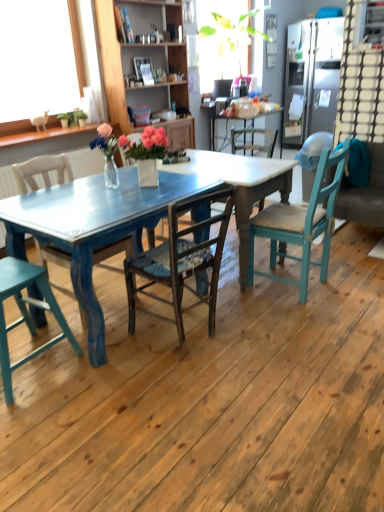
What is the approximate width of satin silver refrigerator at upper right?

It is 32.47 inches.

Looking at this image, what is the approximate width of teal fabric couch at right?

It is 30.17 inches.

Identify the location of wooden chair at center, acting as the 3th chair starting from the right. (42, 170).

Identify the location of satin silver refrigerator at upper right. (311, 77).

Does teal fabric couch at right turn towards wooden cabinet at upper center?

No, teal fabric couch at right is not aimed at wooden cabinet at upper center.

Is teal fabric couch at right inside the boundaries of wooden cabinet at upper center, or outside?

teal fabric couch at right exists outside the volume of wooden cabinet at upper center.

From the picture: From a real-world perspective, is teal fabric couch at right on wooden cabinet at upper center?

Actually, teal fabric couch at right is physically below wooden cabinet at upper center in the real world.

Can you tell me how much teal fabric couch at right and teal painted wood chair at lower left, placed as the 1th chair when sorted from left to right, differ in facing direction?

There is a 177-degree angle between the facing directions of teal fabric couch at right and teal painted wood chair at lower left, placed as the 1th chair when sorted from left to right.

Where is `couch above the teal painted wood chair at lower left, placed as the 1th chair when sorted from left to right (from the image's perspective)`? This screenshot has height=512, width=384. couch above the teal painted wood chair at lower left, placed as the 1th chair when sorted from left to right (from the image's perspective) is located at coordinates (364, 193).

Is teal fabric couch at right placed right next to teal painted wood chair at lower left, placed as the 1th chair when sorted from left to right?

teal fabric couch at right and teal painted wood chair at lower left, placed as the 1th chair when sorted from left to right, are clearly separated.

Which is less distant, (354, 194) or (9, 402)?

Point (354, 194) is farther from the camera than point (9, 402).

Considering the sizes of objects satin silver refrigerator at upper right and teal fabric couch at right in the image provided, who is shorter, satin silver refrigerator at upper right or teal fabric couch at right?

With less height is teal fabric couch at right.

Where is `couch beneath the satin silver refrigerator at upper right (from a real-world perspective)`? The height and width of the screenshot is (512, 384). couch beneath the satin silver refrigerator at upper right (from a real-world perspective) is located at coordinates (364, 193).

Which object is thinner, satin silver refrigerator at upper right or teal fabric couch at right?

teal fabric couch at right is thinner.

Does wooden chair at center, positioned as the second chair in left-to-right order, appear on the right side of teal painted wood chair at lower left, arranged as the 4th chair when viewed from the right?

Correct, you'll find wooden chair at center, positioned as the second chair in left-to-right order, to the right of teal painted wood chair at lower left, arranged as the 4th chair when viewed from the right.

Is teal painted wood chair at lower left, arranged as the 4th chair when viewed from the right, at the back of wooden chair at center, acting as the 3th chair starting from the right?

That's not correct — wooden chair at center, acting as the 3th chair starting from the right, is not looking away from teal painted wood chair at lower left, arranged as the 4th chair when viewed from the right.

Considering the positions of objects wooden chair at center, positioned as the second chair in left-to-right order, and teal painted wood chair at lower left, placed as the 1th chair when sorted from left to right, in the image provided, who is behind, wooden chair at center, positioned as the second chair in left-to-right order, or teal painted wood chair at lower left, placed as the 1th chair when sorted from left to right,?

wooden chair at center, positioned as the second chair in left-to-right order, is further away from the camera.

Is wooden cabinet at upper center inside or outside of wooden chair at center, acting as the second chair starting from the right?

The correct answer is: outside.

Does wooden cabinet at upper center lie in front of wooden chair at center, which is counted as the 3th chair, starting from the left?

No, the depth of wooden cabinet at upper center is greater than that of wooden chair at center, which is counted as the 3th chair, starting from the left.

Which object is wider, wooden cabinet at upper center or wooden chair at center, acting as the second chair starting from the right?

Wider between the two is wooden chair at center, acting as the second chair starting from the right.

Is wooden chair at center, acting as the second chair starting from the right, aimed at teal painted wood chair at lower left, arranged as the 4th chair when viewed from the right?

No, wooden chair at center, acting as the second chair starting from the right, is not facing towards teal painted wood chair at lower left, arranged as the 4th chair when viewed from the right.

Is wooden chair at center, acting as the second chair starting from the right, wider than teal painted wood chair at lower left, arranged as the 4th chair when viewed from the right?

Yes, wooden chair at center, acting as the second chair starting from the right, is wider than teal painted wood chair at lower left, arranged as the 4th chair when viewed from the right.

Measure the distance between wooden chair at center, which is counted as the 3th chair, starting from the left, and teal painted wood chair at lower left, placed as the 1th chair when sorted from left to right.

wooden chair at center, which is counted as the 3th chair, starting from the left, and teal painted wood chair at lower left, placed as the 1th chair when sorted from left to right, are 23.90 inches apart.

From a real-world perspective, is wooden chair at center, which is counted as the 3th chair, starting from the left, beneath teal painted wood chair at lower left, placed as the 1th chair when sorted from left to right?

Actually, wooden chair at center, which is counted as the 3th chair, starting from the left, is physically above teal painted wood chair at lower left, placed as the 1th chair when sorted from left to right, in the real world.

Considering the relative sizes of teal painted wood chair at lower left, arranged as the 4th chair when viewed from the right, and wooden cabinet at upper center in the image provided, is teal painted wood chair at lower left, arranged as the 4th chair when viewed from the right, shorter than wooden cabinet at upper center?

Yes, teal painted wood chair at lower left, arranged as the 4th chair when viewed from the right, is shorter than wooden cabinet at upper center.

Is point (2, 260) more distant than point (193, 118)?

No, it is in front of (193, 118).

Considering their positions, is teal painted wood chair at lower left, arranged as the 4th chair when viewed from the right, located in front of or behind wooden cabinet at upper center?

Clearly, teal painted wood chair at lower left, arranged as the 4th chair when viewed from the right, is in front of wooden cabinet at upper center.

Image resolution: width=384 pixels, height=512 pixels. What are the coordinates of `cabinetry to the left of teal fabric couch at right` in the screenshot? It's located at (152, 65).

The height and width of the screenshot is (512, 384). I want to click on couch below the teal painted wood chair at lower left, arranged as the 4th chair when viewed from the right (from a real-world perspective), so click(x=364, y=193).

Looking at the image, which one is located closer to teal wood chair at right, the 4th chair from the left, teal painted wood chair at lower left, arranged as the 4th chair when viewed from the right, or wooden chair at center, acting as the 3th chair starting from the right?

The object closer to teal wood chair at right, the 4th chair from the left, is teal painted wood chair at lower left, arranged as the 4th chair when viewed from the right.

From the image, which object appears to be nearer to teal fabric couch at right, teal painted wood chair at lower left, arranged as the 4th chair when viewed from the right, or satin silver refrigerator at upper right?

satin silver refrigerator at upper right lies closer to teal fabric couch at right than the other object.

Based on their spatial positions, is wooden chair at center, positioned as the second chair in left-to-right order, or wooden cabinet at upper center closer to satin silver refrigerator at upper right?

Among the two, wooden cabinet at upper center is located nearer to satin silver refrigerator at upper right.

Which object lies nearer to the anchor point teal wood chair at right, the 4th chair from the left, wooden cabinet at upper center or teal painted wood chair at lower left, placed as the 1th chair when sorted from left to right?

teal painted wood chair at lower left, placed as the 1th chair when sorted from left to right, is closer to teal wood chair at right, the 4th chair from the left.

Which object lies nearer to the anchor point wooden chair at center, acting as the 3th chair starting from the right, wooden cabinet at upper center or teal fabric couch at right?

wooden cabinet at upper center lies closer to wooden chair at center, acting as the 3th chair starting from the right, than the other object.

When comparing their distances from teal painted wood chair at lower left, placed as the 1th chair when sorted from left to right, does wooden chair at center, which is counted as the 3th chair, starting from the left, or wooden cabinet at upper center seem further?

wooden cabinet at upper center is further to teal painted wood chair at lower left, placed as the 1th chair when sorted from left to right.

Which object lies further to the anchor point teal painted wood chair at lower left, placed as the 1th chair when sorted from left to right, wooden cabinet at upper center or satin silver refrigerator at upper right?

satin silver refrigerator at upper right lies further to teal painted wood chair at lower left, placed as the 1th chair when sorted from left to right, than the other object.

Looking at the image, which one is located closer to wooden chair at center, acting as the second chair starting from the right, teal fabric couch at right or teal wood chair at right, the 4th chair from the left?

teal wood chair at right, the 4th chair from the left, is closer to wooden chair at center, acting as the second chair starting from the right.

This screenshot has height=512, width=384. Find the location of `chair between wooden chair at center, acting as the 3th chair starting from the right, and teal wood chair at right, the 4th chair from the left, from left to right`. chair between wooden chair at center, acting as the 3th chair starting from the right, and teal wood chair at right, the 4th chair from the left, from left to right is located at coordinates (182, 261).

Find the location of `cabinetry between wooden chair at center, positioned as the second chair in left-to-right order, and satin silver refrigerator at upper right from front to back`. cabinetry between wooden chair at center, positioned as the second chair in left-to-right order, and satin silver refrigerator at upper right from front to back is located at coordinates (152, 65).

Where is `couch positioned between teal painted wood chair at lower left, arranged as the 4th chair when viewed from the right, and satin silver refrigerator at upper right from near to far`? The height and width of the screenshot is (512, 384). couch positioned between teal painted wood chair at lower left, arranged as the 4th chair when viewed from the right, and satin silver refrigerator at upper right from near to far is located at coordinates (364, 193).

Locate an element on the screen. This screenshot has height=512, width=384. cabinetry between teal painted wood chair at lower left, placed as the 1th chair when sorted from left to right, and teal fabric couch at right, in the horizontal direction is located at coordinates (152, 65).